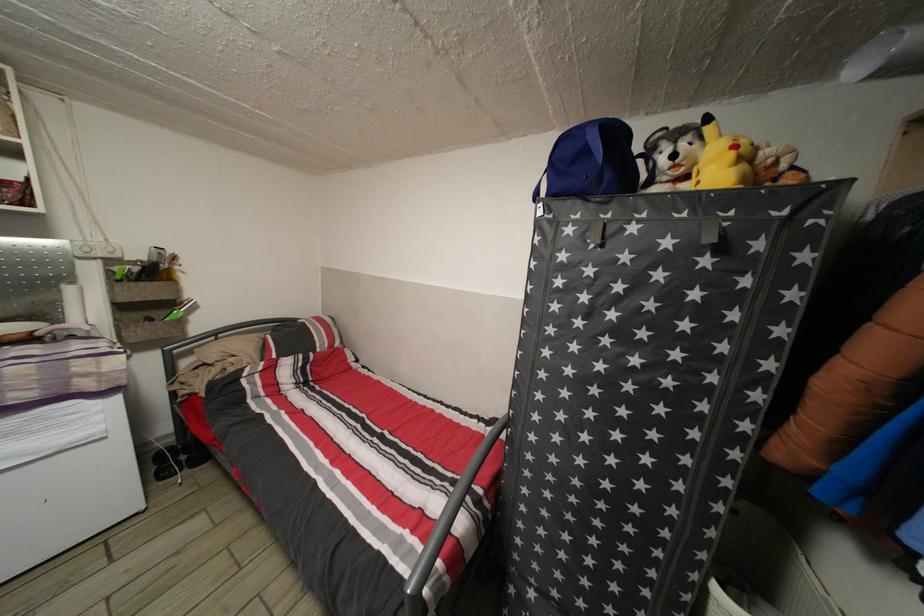
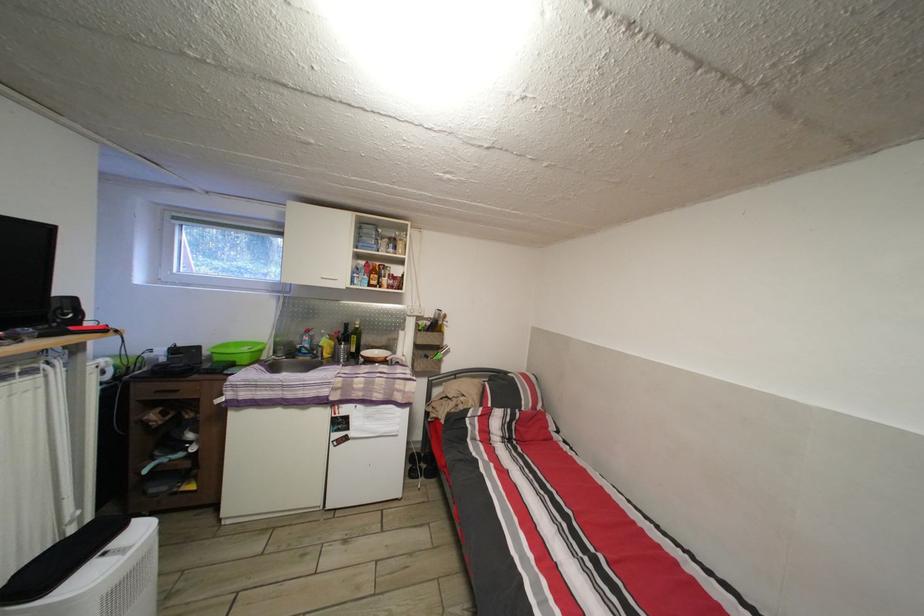
Question: The camera is either moving clockwise (left) or counter-clockwise (right) around the object. The first image is from the beginning of the video and the second image is from the end. Is the camera moving left or right when shooting the video?

Choices:
 (A) Left
 (B) Right

Answer: (B)